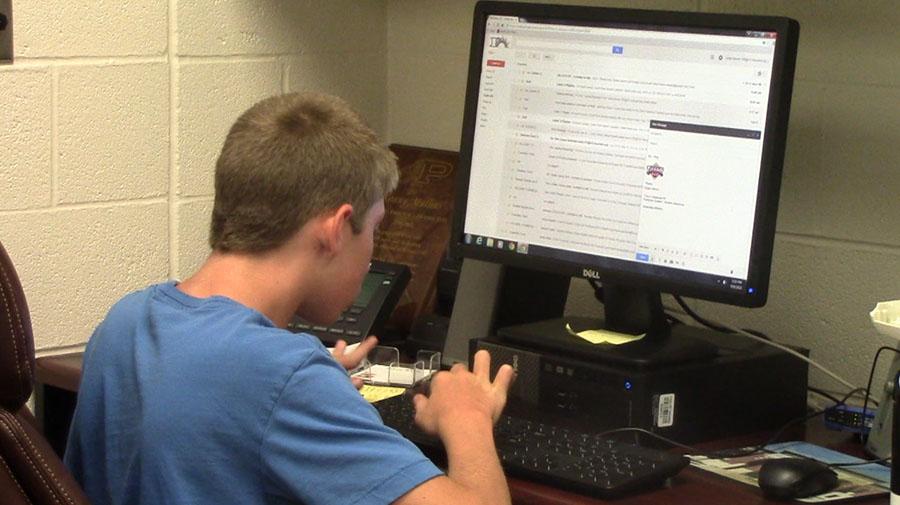
You are a GUI agent. You are given a task and a screenshot of the screen. Output one action in this format:
    pyautogui.click(x=<x>, y=<y>)
    Task: Click on the phone
    Image resolution: width=900 pixels, height=505 pixels.
    Given the screenshot: What is the action you would take?
    pyautogui.click(x=367, y=314)